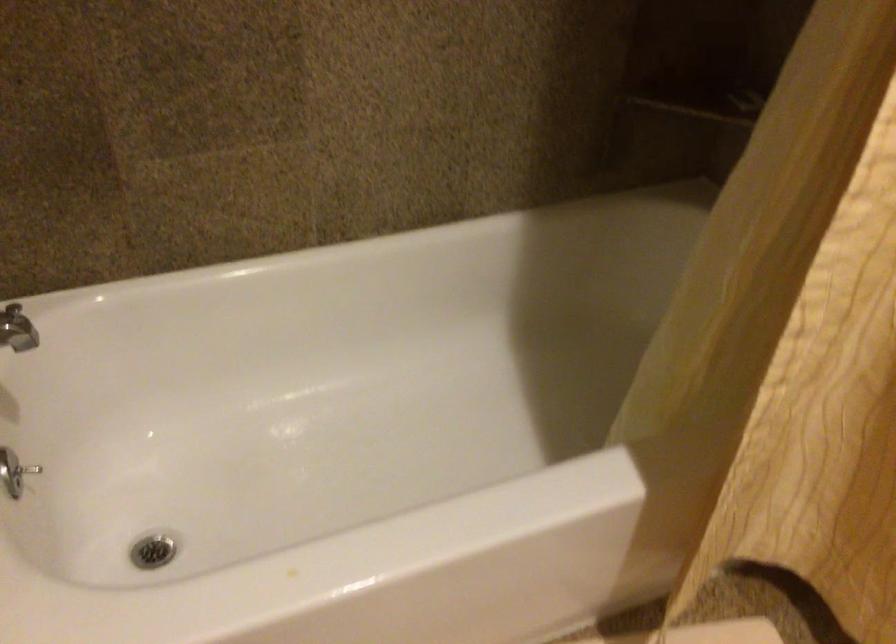
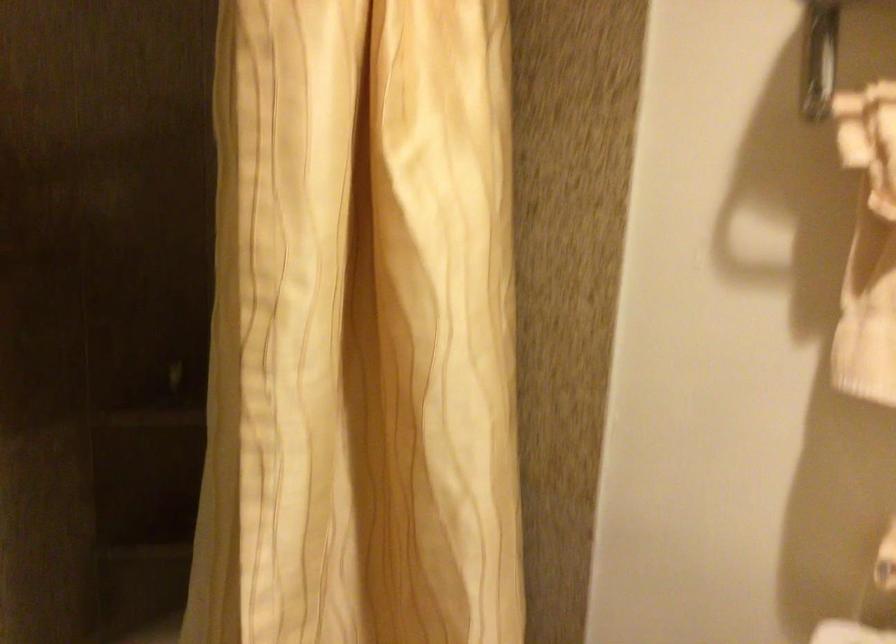
The first image is from the beginning of the video and the second image is from the end. How did the camera likely rotate when shooting the video?

The rotation direction of the camera is right-up.